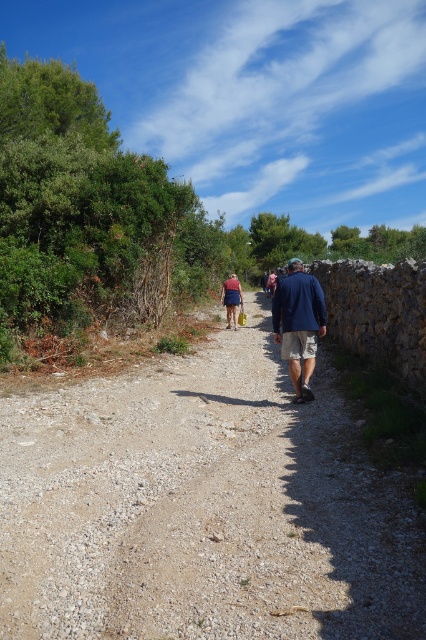
Question: Which of the following is the farthest from the observer?

Choices:
 (A) (310, 337)
 (B) (123, 403)

Answer: (B)

Question: Which of the following is the closest to the observer?

Choices:
 (A) dusty gravel path at center
 (B) navy blue jacket at center

Answer: (A)

Question: Is dusty gravel path at center further to camera compared to navy blue jacket at center?

Choices:
 (A) yes
 (B) no

Answer: (B)

Question: Does dusty gravel path at center appear on the left side of navy blue jacket at center?

Choices:
 (A) yes
 (B) no

Answer: (A)

Question: Which point appears farthest from the camera in this image?

Choices:
 (A) (305, 371)
 (B) (348, 564)

Answer: (A)

Question: Does dusty gravel path at center come in front of navy blue jacket at center?

Choices:
 (A) no
 (B) yes

Answer: (B)